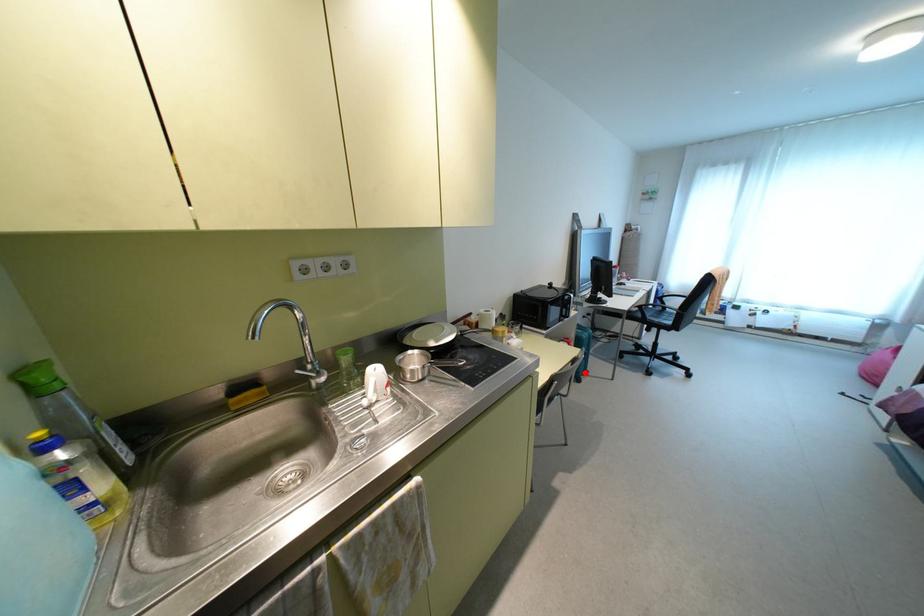
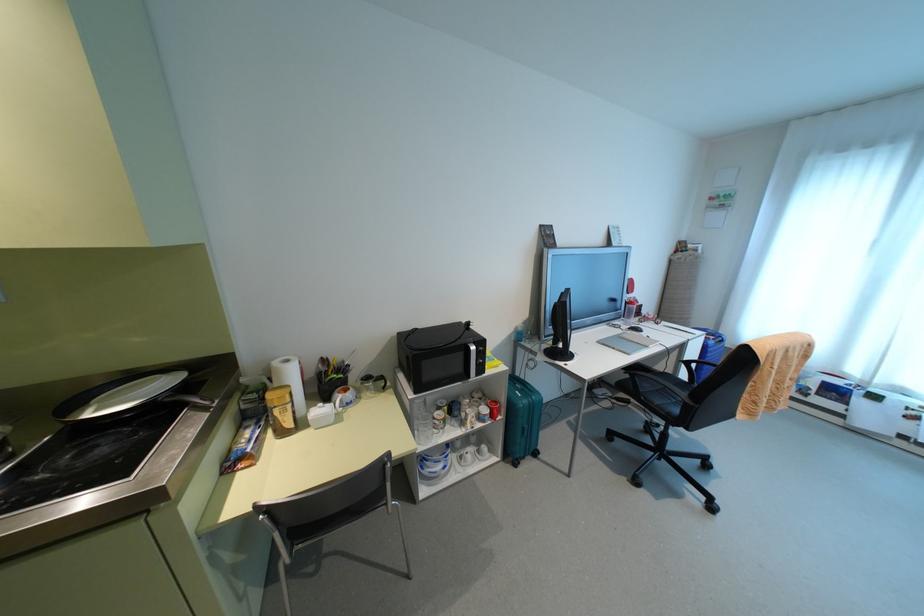
Question: I am providing you with two images of the same scene from different viewpoints. In image1, a red point is highlighted. Considering the same 3D point in image2, which of the following is correct?

Choices:
 (A) It is closer
 (B) It is farther

Answer: (A)